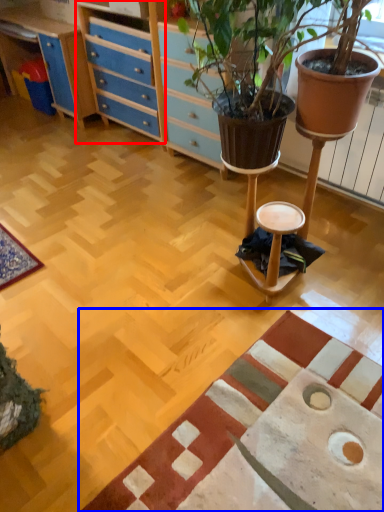
Question: Which object appears farthest to the camera in this image, file cabinet (highlighted by a red box) or mat (highlighted by a blue box)?

Choices:
 (A) file cabinet
 (B) mat

Answer: (A)